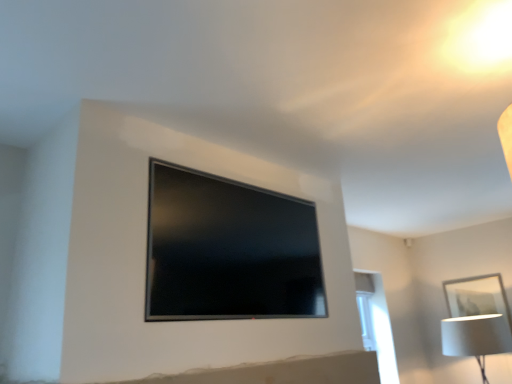
Question: Is white matte picture frame at lower right looking in the opposite direction of white glossy window at right?

Choices:
 (A) yes
 (B) no

Answer: (B)

Question: Is white matte picture frame at lower right smaller than white glossy window at right?

Choices:
 (A) yes
 (B) no

Answer: (A)

Question: From the image's perspective, would you say white matte picture frame at lower right is positioned over white glossy window at right?

Choices:
 (A) yes
 (B) no

Answer: (A)

Question: From a real-world perspective, is white matte picture frame at lower right physically above white glossy window at right?

Choices:
 (A) no
 (B) yes

Answer: (B)

Question: Can you confirm if white matte picture frame at lower right is shorter than white glossy window at right?

Choices:
 (A) no
 (B) yes

Answer: (B)

Question: Considering the positions of white glossy window at right and matte black tv at center in the image, is white glossy window at right taller or shorter than matte black tv at center?

Choices:
 (A) short
 (B) tall

Answer: (B)

Question: From the image's perspective, relative to matte black tv at center, is white glossy window at right above or below?

Choices:
 (A) above
 (B) below

Answer: (B)

Question: Considering their positions, is white glossy window at right located in front of or behind matte black tv at center?

Choices:
 (A) front
 (B) behind

Answer: (B)

Question: In terms of size, does white glossy window at right appear bigger or smaller than matte black tv at center?

Choices:
 (A) big
 (B) small

Answer: (A)

Question: From the image's perspective, relative to white glossy window at right, is white matte picture frame at lower right above or below?

Choices:
 (A) above
 (B) below

Answer: (A)

Question: In the image, is white matte picture frame at lower right positioned in front of or behind white glossy window at right?

Choices:
 (A) front
 (B) behind

Answer: (B)

Question: Is point (446, 306) positioned closer to the camera than point (365, 334)?

Choices:
 (A) closer
 (B) farther

Answer: (B)

Question: Looking at the image, does white matte picture frame at lower right seem bigger or smaller compared to white glossy window at right?

Choices:
 (A) big
 (B) small

Answer: (B)

Question: Choose the correct answer: Is white matte picture frame at lower right inside white fabric lampshade at lower right or outside it?

Choices:
 (A) outside
 (B) inside

Answer: (A)

Question: Would you say white matte picture frame at lower right is to the left or to the right of white fabric lampshade at lower right in the picture?

Choices:
 (A) left
 (B) right

Answer: (B)